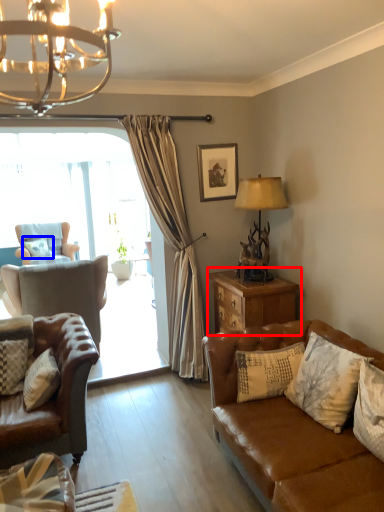
Question: Which object is further to the camera taking this photo, nightstand (highlighted by a red box) or pillow (highlighted by a blue box)?

Choices:
 (A) nightstand
 (B) pillow

Answer: (B)